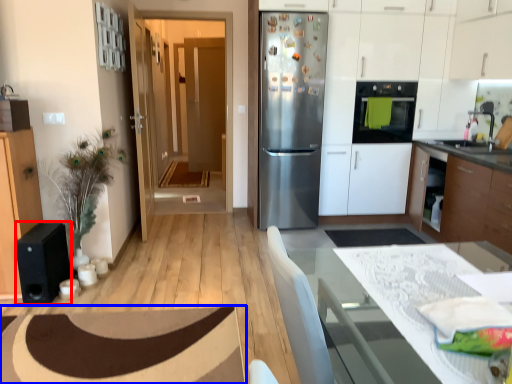
Question: Which object is closer to the camera taking this photo, appliance (highlighted by a red box) or plain (highlighted by a blue box)?

Choices:
 (A) appliance
 (B) plain

Answer: (B)